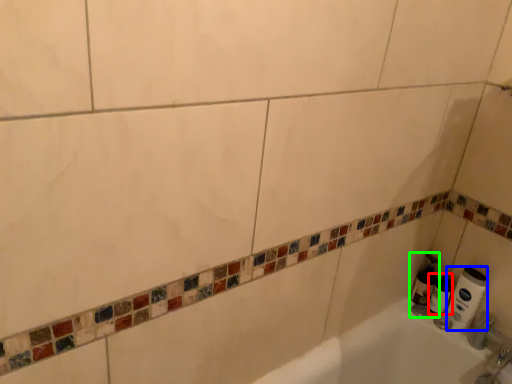
Question: Considering the real-world distances, which object is farthest from toilet paper (highlighted by a red box)? toilet paper (highlighted by a blue box) or soap dispenser (highlighted by a green box)?

Choices:
 (A) toilet paper
 (B) soap dispenser

Answer: (A)